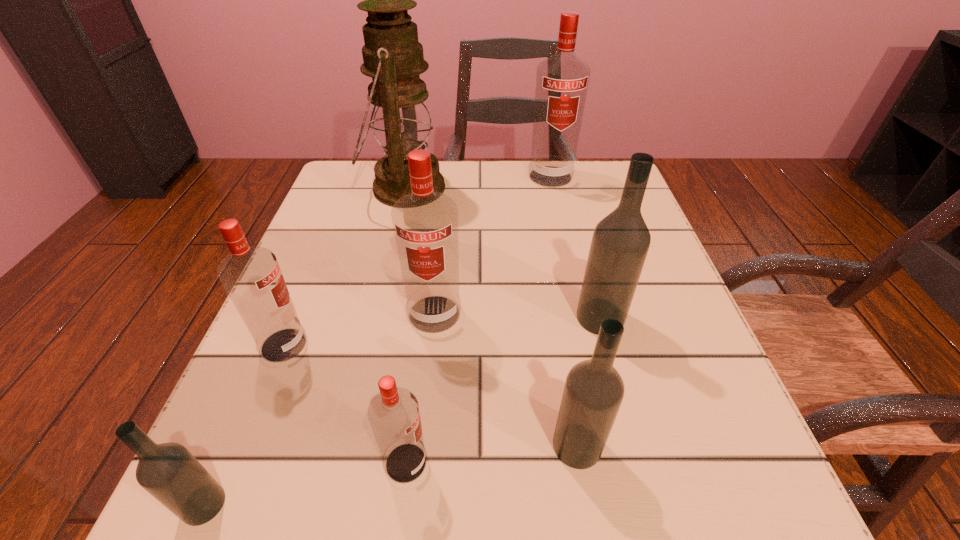
I want to click on oil lamp that is at the far edge, so click(x=401, y=122).

Where is `vodka that is at the far edge`? vodka that is at the far edge is located at coordinates (562, 80).

I want to click on oil lamp present at the left edge, so click(x=401, y=122).

Find the location of a particular element. object that is at the far left corner is located at coordinates (401, 122).

The width and height of the screenshot is (960, 540). I want to click on object located at the near left corner, so click(x=168, y=471).

Image resolution: width=960 pixels, height=540 pixels. Identify the location of object located in the far right corner section of the desktop. (562, 80).

I want to click on vacant space at the far edge of the desktop, so click(x=517, y=203).

The image size is (960, 540). Find the location of `vacant space at the near edge of the desktop`. vacant space at the near edge of the desktop is located at coordinates (515, 527).

Find the location of a particular element. The image size is (960, 540). free space at the left edge of the desktop is located at coordinates (324, 353).

This screenshot has width=960, height=540. Find the location of `vacant region at the right edge of the desktop`. vacant region at the right edge of the desktop is located at coordinates (660, 341).